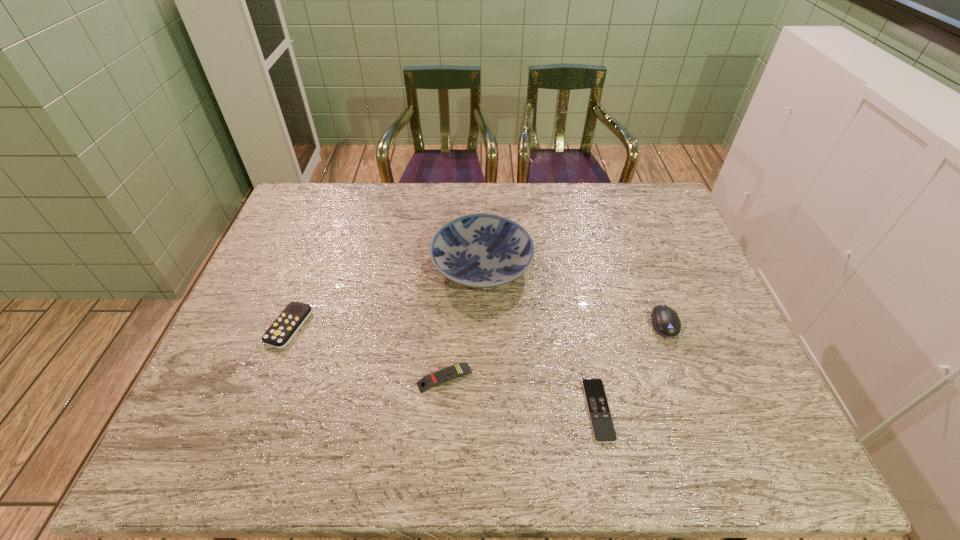
The height and width of the screenshot is (540, 960). In order to click on unoccupied position between the computer mouse and the farthest object in this screenshot , I will do `click(573, 294)`.

Where is `free spot between the shortest object and the leftmost object`? The height and width of the screenshot is (540, 960). free spot between the shortest object and the leftmost object is located at coordinates (444, 368).

This screenshot has width=960, height=540. Identify the location of vacant point located between the second tallest object and the second tallest remote control. (555, 350).

Select which object is the closest to the tallest object. Please provide its 2D coordinates. Your answer should be formatted as a tuple, i.e. [(x, y)], where the tuple contains the x and y coordinates of a point satisfying the conditions above.

[(449, 373)]

In order to click on object that is the fourth nearest to the farthest object in this screenshot , I will do `click(280, 333)`.

You are a GUI agent. You are given a task and a screenshot of the screen. Output one action in this format:
    pyautogui.click(x=<x>, y=<y>)
    Task: Click on the remote control that stands as the closest to the leftmost object
    The width and height of the screenshot is (960, 540).
    Given the screenshot: What is the action you would take?
    pyautogui.click(x=449, y=373)

Point out which remote control is positioned as the nearest to the leftmost remote control. Please provide its 2D coordinates. Your answer should be formatted as a tuple, i.e. [(x, y)], where the tuple contains the x and y coordinates of a point satisfying the conditions above.

[(449, 373)]

In order to click on vacant point that satisfies the following two spatial constraints: 1. on the front side of the third tallest object; 2. on the right side of the fourth object from left to right in this screenshot , I will do `click(257, 410)`.

This screenshot has width=960, height=540. In order to click on vacant area in the image that satisfies the following two spatial constraints: 1. on the front side of the tallest object; 2. on the left side of the fourth shortest object in this screenshot , I will do `click(482, 323)`.